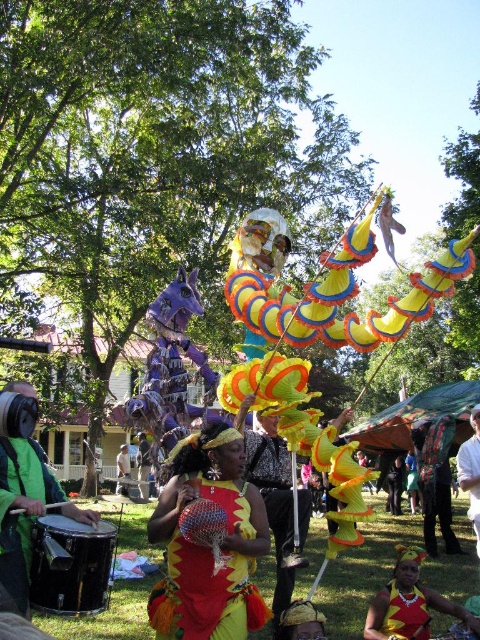
You are organizing a small parade and need to arrange the green matte drum at left and the white cotton shirt at center in a line. If the drum is narrower than the shirt, which object should be placed first to ensure they fit within a 1.2 meter wide space?

The green matte drum at left has a smaller width than the white cotton shirt at center. To fit both within the 1.2 meter space, place the narrower drum first, followed by the shirt, ensuring their combined widths do not exceed the available space.

You are an attendee at the festival and want to take a photo of both the shiny yellow fabric at center and the yellow fabric headdress at center. Which object should you focus on first if you want to capture both in the same frame without moving the camera?

Since the shiny yellow fabric at center is smaller in size compared to the yellow fabric headdress at center, you should focus on the shiny yellow fabric at center first to ensure it is centered and in focus before adjusting the camera settings to include the larger headdress in the frame.